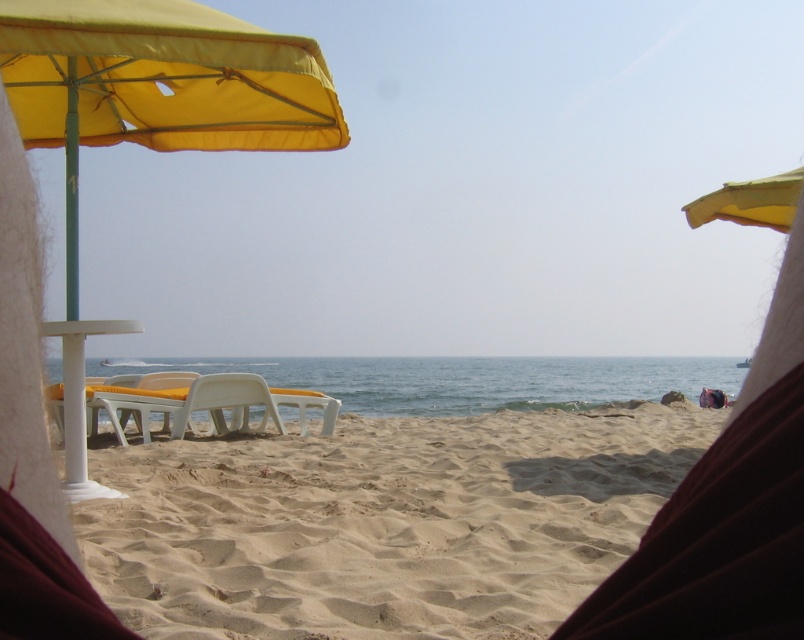
You are planning to set up a picnic area on the beach. You have a white plastic beach chair at center and a yellow matte umbrella at upper right. To ensure the chair stays dry from the incoming waves, which object should you move and in which direction?

The yellow matte umbrella at upper right is behind the white plastic beach chair at center. To keep the chair dry, you should move the yellow matte umbrella at upper right away from the chair towards the upper right direction, so the chair is positioned further away from the water.

You are planning to set up a beach umbrella for shade. You have two options in the scene. Which one is thinner between the yellow fabric umbrella at left and the yellow fabric umbrella at upper left?

The yellow fabric umbrella at left is thinner than the yellow fabric umbrella at upper left.

You are standing at the beach and see two points marked on the image. The first point is at coordinate point(306, 404) and the second is at point(790, 182). Which point is closer to you?

Point(306, 404) is further to the camera than point(790, 182), so the point closer to you is point(790, 182).